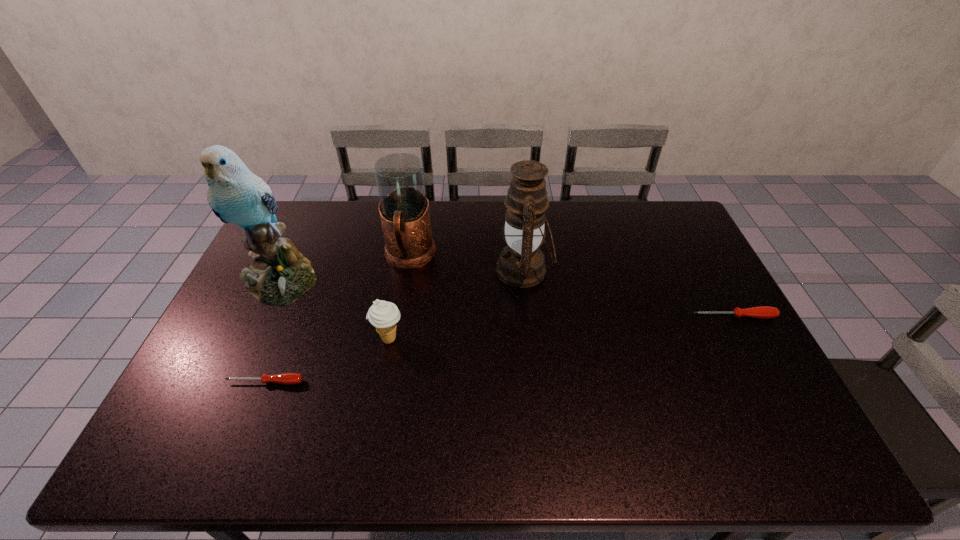
Find the location of a particular element. The height and width of the screenshot is (540, 960). object located in the near left corner section of the desktop is located at coordinates (285, 378).

This screenshot has height=540, width=960. In order to click on vacant space at the far edge of the desktop in this screenshot , I will do click(476, 224).

In the image, there is a desktop. Where is `free space at the near edge`? Image resolution: width=960 pixels, height=540 pixels. free space at the near edge is located at coordinates (454, 397).

What are the coordinates of `free space at the left edge of the desktop` in the screenshot? It's located at (236, 362).

Locate an element on the screen. The image size is (960, 540). free space at the right edge of the desktop is located at coordinates (710, 316).

This screenshot has width=960, height=540. In the image, there is a desktop. What are the coordinates of `vacant region at the far left corner` in the screenshot? It's located at (306, 231).

In the image, there is a desktop. What are the coordinates of `free region at the near left corner` in the screenshot? It's located at (216, 416).

The image size is (960, 540). Find the location of `blank space at the far right corner`. blank space at the far right corner is located at coordinates (686, 239).

Identify the location of vacant space at the near right corner. Image resolution: width=960 pixels, height=540 pixels. (740, 390).

Identify the location of free space between the fourth tallest object and the tallest object. (335, 309).